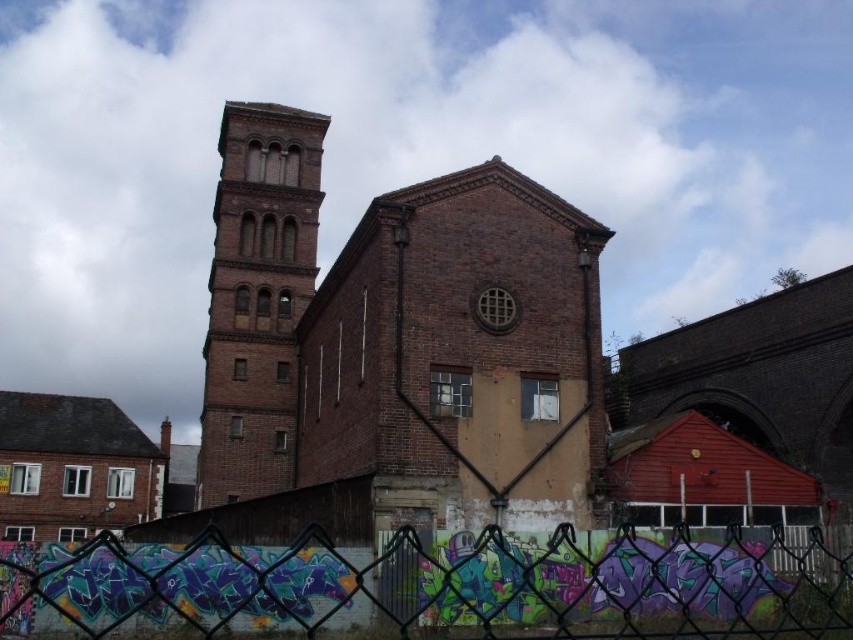
You are standing in front of the building and notice two points marked on the chain link fence. The first point is at coordinates point (334, 609) and the second is at point (309, 218). Which point is closer to you?

Point (334, 609) is closer to the viewer than point (309, 218).